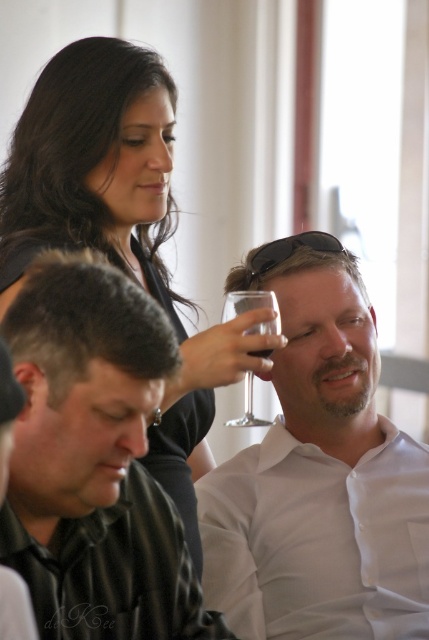
Between white glossy shirt at upper center and black shirt at upper left, which one appears on the right side from the viewer's perspective?

From the viewer's perspective, white glossy shirt at upper center appears more on the right side.

Between point (254, 483) and point (91, 449), which one is positioned behind?

The point (254, 483) is behind.

The width and height of the screenshot is (429, 640). Find the location of `white glossy shirt at upper center`. white glossy shirt at upper center is located at coordinates (319, 476).

Locate an element on the screen. white glossy shirt at upper center is located at coordinates (319, 476).

Is point (129, 497) farther from camera compared to point (265, 420)?

That is False.

Where is `black shirt at upper left`? The image size is (429, 640). black shirt at upper left is located at coordinates (x=94, y=461).

Is point (20, 376) positioned after point (251, 401)?

That is False.

What are the coordinates of `black shirt at upper left` in the screenshot? It's located at (94, 461).

Is white glossy shirt at upper center further to camera compared to black shirt at lower left?

Yes.

Does white glossy shirt at upper center have a greater width compared to black shirt at lower left?

Yes, white glossy shirt at upper center is wider than black shirt at lower left.

I want to click on white glossy shirt at upper center, so click(x=319, y=476).